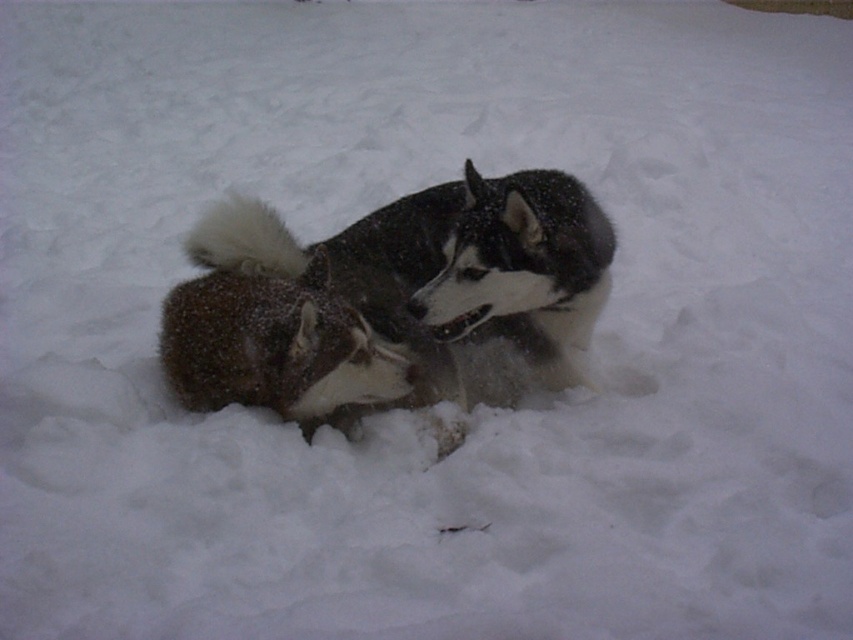
Does black and white fur dog at center come in front of fuzzy fur dog at center?

Yes, black and white fur dog at center is in front of fuzzy fur dog at center.

Between point (561, 333) and point (213, 308), which one is positioned in front?

Point (213, 308) is more forward.

Which is in front, point (347, 424) or point (244, 275)?

Positioned in front is point (347, 424).

The height and width of the screenshot is (640, 853). In order to click on black and white fur dog at center in this screenshot , I will do `click(386, 298)`.